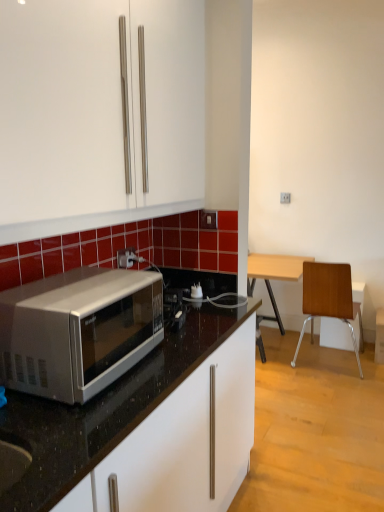
Question: From a real-world perspective, is silver metallic microwave at left below white plastic power outlet at center?

Choices:
 (A) yes
 (B) no

Answer: (A)

Question: Does silver metallic microwave at left have a lesser width compared to white plastic power outlet at center?

Choices:
 (A) no
 (B) yes

Answer: (A)

Question: Could you tell me if silver metallic microwave at left is facing white plastic power outlet at center?

Choices:
 (A) yes
 (B) no

Answer: (B)

Question: From a real-world perspective, is silver metallic microwave at left positioned over white plastic power outlet at center based on gravity?

Choices:
 (A) no
 (B) yes

Answer: (A)

Question: Does silver metallic microwave at left have a larger size compared to white plastic power outlet at center?

Choices:
 (A) no
 (B) yes

Answer: (B)

Question: Based on their positions, is white plastic power outlet at center located to the left or right of silver metallic microwave at left?

Choices:
 (A) left
 (B) right

Answer: (A)

Question: From a real-world perspective, is white plastic power outlet at center above or below silver metallic microwave at left?

Choices:
 (A) above
 (B) below

Answer: (A)

Question: Looking at their shapes, would you say white plastic power outlet at center is wider or thinner than silver metallic microwave at left?

Choices:
 (A) wide
 (B) thin

Answer: (B)

Question: Considering the positions of white plastic power outlet at center and silver metallic microwave at left in the image, is white plastic power outlet at center bigger or smaller than silver metallic microwave at left?

Choices:
 (A) big
 (B) small

Answer: (B)

Question: Based on their positions, is wooden/metallic chair at right located to the left or right of silver metallic microwave at left?

Choices:
 (A) left
 (B) right

Answer: (B)

Question: Relative to silver metallic microwave at left, is wooden/metallic chair at right in front or behind?

Choices:
 (A) front
 (B) behind

Answer: (B)

Question: Is wooden/metallic chair at right taller or shorter than silver metallic microwave at left?

Choices:
 (A) short
 (B) tall

Answer: (B)

Question: Is wooden/metallic chair at right wider or thinner than silver metallic microwave at left?

Choices:
 (A) thin
 (B) wide

Answer: (B)

Question: Is silver metallic microwave at left taller or shorter than white plastic power outlet at center?

Choices:
 (A) short
 (B) tall

Answer: (B)

Question: Would you say silver metallic microwave at left is inside or outside white plastic power outlet at center?

Choices:
 (A) inside
 (B) outside

Answer: (B)